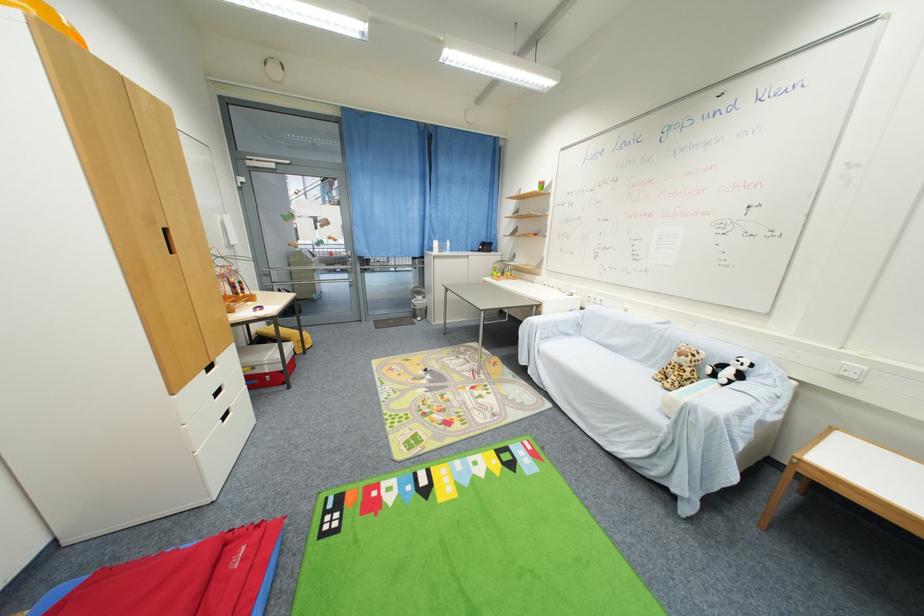
What do you see at coordinates (264, 363) in the screenshot? I see `the red storage box` at bounding box center [264, 363].